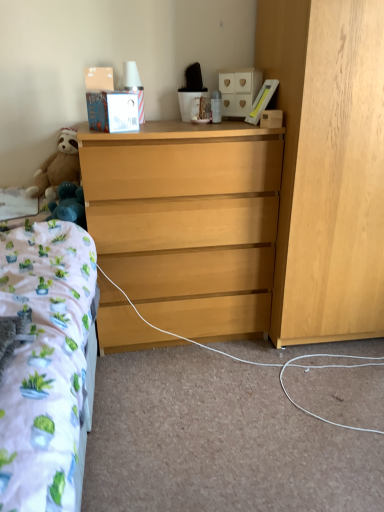
Question: Is light wood dresser at center at the left side of wooden box at upper right?

Choices:
 (A) yes
 (B) no

Answer: (A)

Question: Considering the relative sizes of light wood dresser at center and wooden box at upper right in the image provided, is light wood dresser at center wider than wooden box at upper right?

Choices:
 (A) yes
 (B) no

Answer: (A)

Question: From a real-world perspective, is light wood dresser at center on top of wooden box at upper right?

Choices:
 (A) no
 (B) yes

Answer: (A)

Question: Considering the relative positions of light wood dresser at center and wooden box at upper right in the image provided, is light wood dresser at center to the right of wooden box at upper right from the viewer's perspective?

Choices:
 (A) no
 (B) yes

Answer: (A)

Question: Considering the relative positions of light wood dresser at center and wooden box at upper right in the image provided, is light wood dresser at center behind wooden box at upper right?

Choices:
 (A) no
 (B) yes

Answer: (A)

Question: In terms of width, does light wood dresser at right, which is the first cabinetry from right to left, look wider or thinner when compared to blue plush toy at left?

Choices:
 (A) thin
 (B) wide

Answer: (B)

Question: Based on their positions, is light wood dresser at right, which is the first cabinetry from right to left, located to the left or right of blue plush toy at left?

Choices:
 (A) left
 (B) right

Answer: (B)

Question: In the image, is light wood dresser at right, the 2th cabinetry from the top, positioned in front of or behind blue plush toy at left?

Choices:
 (A) front
 (B) behind

Answer: (A)

Question: From the image's perspective, is light wood dresser at right, which is the first cabinetry from right to left, above or below blue plush toy at left?

Choices:
 (A) below
 (B) above

Answer: (B)

Question: In terms of width, does brown plush teddy bear at left look wider or thinner when compared to blue plush toy at left?

Choices:
 (A) thin
 (B) wide

Answer: (A)

Question: From a real-world perspective, is brown plush teddy bear at left above or below blue plush toy at left?

Choices:
 (A) below
 (B) above

Answer: (B)

Question: From the image's perspective, is brown plush teddy bear at left above or below blue plush toy at left?

Choices:
 (A) below
 (B) above

Answer: (B)

Question: Is brown plush teddy bear at left in front of or behind blue plush toy at left in the image?

Choices:
 (A) behind
 (B) front

Answer: (A)

Question: In terms of width, does light wood dresser at center look wider or thinner when compared to brown plush teddy bear at left?

Choices:
 (A) wide
 (B) thin

Answer: (A)

Question: From their relative heights in the image, would you say light wood dresser at center is taller or shorter than brown plush teddy bear at left?

Choices:
 (A) short
 (B) tall

Answer: (B)